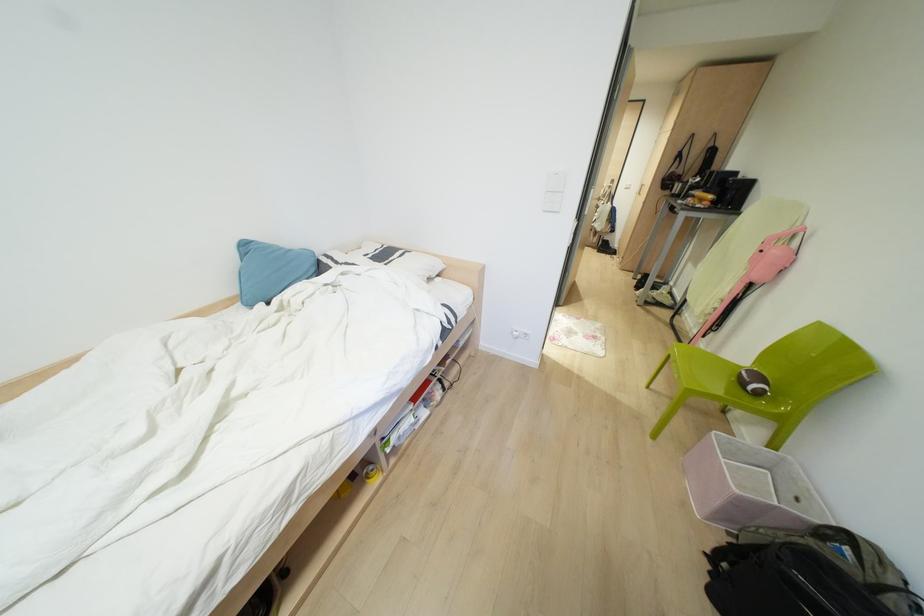
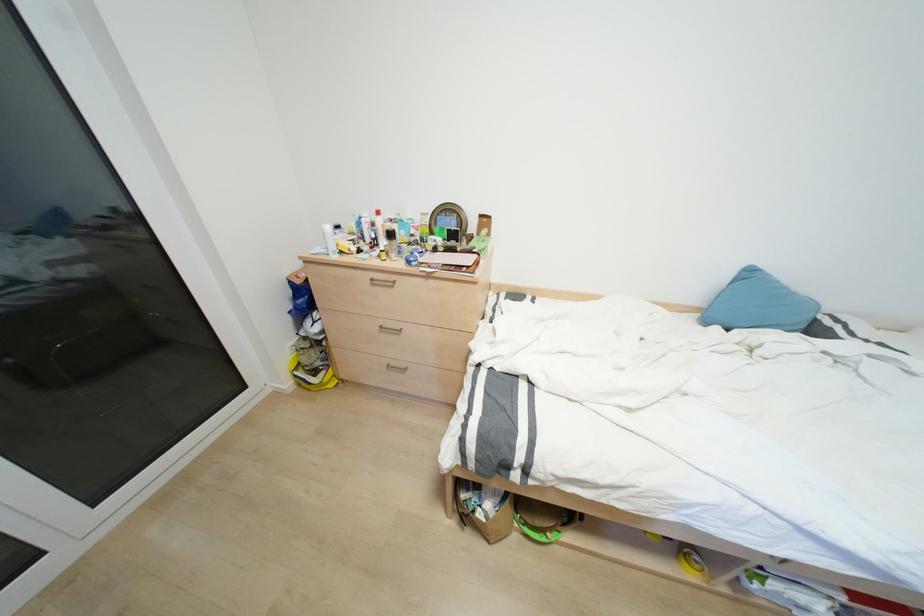
The first image is from the beginning of the video and the second image is from the end. How did the camera likely rotate when shooting the video?

The rotation direction of the camera is left-down.